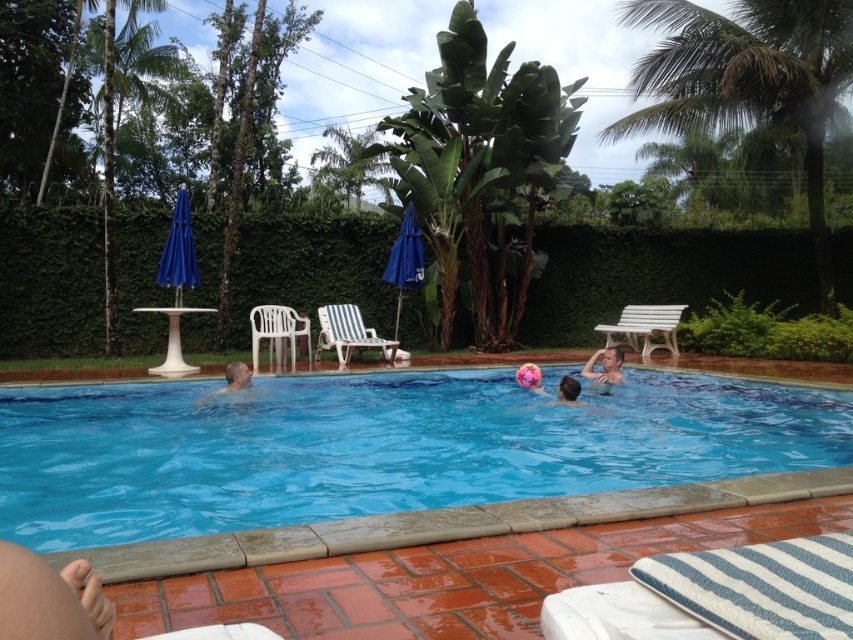
You are a guest at this pool party and want to take a photo of the smooth skin man at center without including the green leafy hedge at upper center in the frame. How should you adjust your camera angle?

To exclude the green leafy hedge at upper center from the photo, lower your camera angle so that the hedge is out of view while keeping the smooth skin man at center in the frame.

You are standing at the point with coordinates point (x=572, y=385) and want to walk to the point with coordinates point (x=270, y=307). Which direction should you move in to reach your destination?

To reach point (x=270, y=307) from point (x=572, y=385), you should move towards the direction that is north or upwards since point (x=270, y=307) is behind point (x=572, y=385).